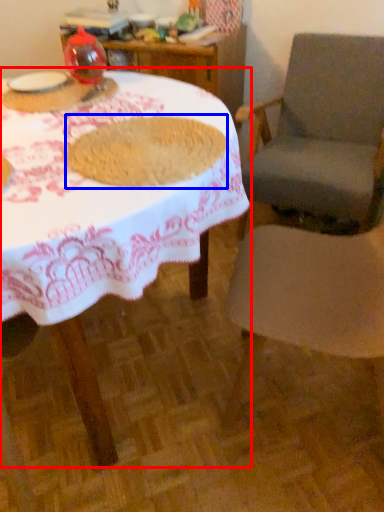
Question: Which object is further to the camera taking this photo, table (highlighted by a red box) or food (highlighted by a blue box)?

Choices:
 (A) table
 (B) food

Answer: (B)